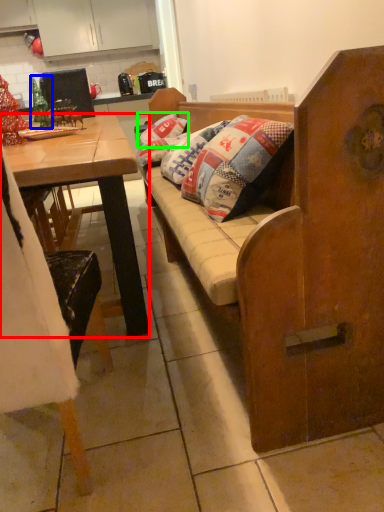
Question: Considering the real-world distances, which object is farthest from desk (highlighted by a red box)? christmas decoration (highlighted by a blue box) or pillow (highlighted by a green box)?

Choices:
 (A) christmas decoration
 (B) pillow

Answer: (B)